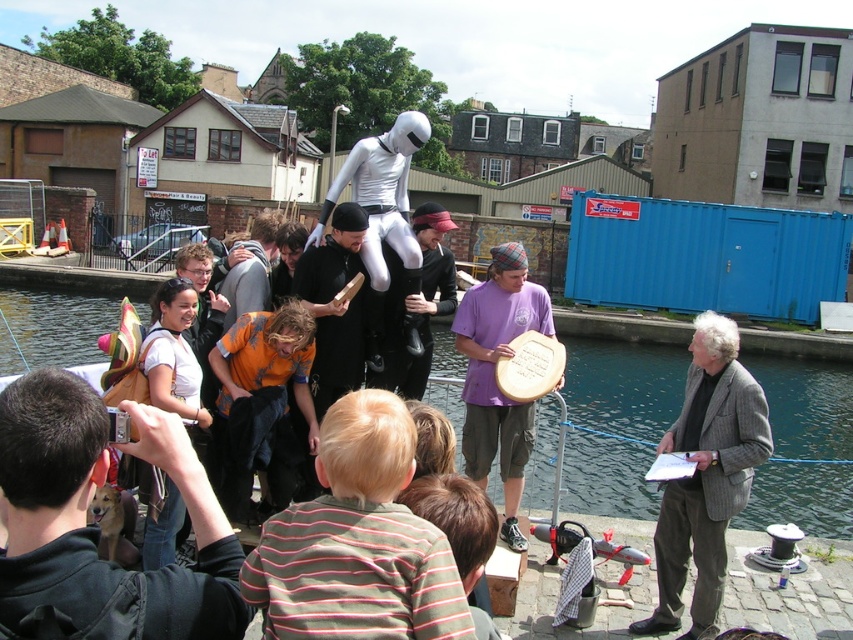
Is gray woolen blazer at right wider than purple cotton shirt at center?

Yes.

How distant is gray woolen blazer at right from purple cotton shirt at center?

gray woolen blazer at right is 5.45 feet away from purple cotton shirt at center.

Is point (657, 564) closer to viewer compared to point (523, 413)?

That is True.

The width and height of the screenshot is (853, 640). In order to click on gray woolen blazer at right in this screenshot , I will do `click(706, 476)`.

Where is `transparent water at center`? The height and width of the screenshot is (640, 853). transparent water at center is located at coordinates (618, 422).

Between transparent water at center and gray woolen blazer at right, which one is positioned lower?

Positioned lower is gray woolen blazer at right.

Find the location of a particular element. Image resolution: width=853 pixels, height=640 pixels. transparent water at center is located at coordinates (618, 422).

The width and height of the screenshot is (853, 640). In order to click on transparent water at center in this screenshot , I will do `click(618, 422)`.

Describe the element at coordinates (618, 422) in the screenshot. I see `transparent water at center` at that location.

Does transparent water at center have a greater height compared to dark brown leather jacket at lower left?

Correct, transparent water at center is much taller as dark brown leather jacket at lower left.

Who is more distant from viewer, (570, 436) or (45, 564)?

Point (570, 436)

The height and width of the screenshot is (640, 853). Find the location of `transparent water at center`. transparent water at center is located at coordinates (618, 422).